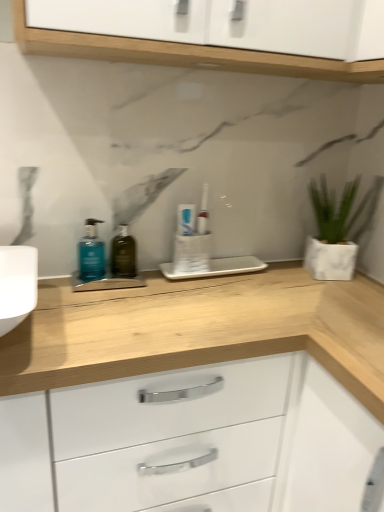
Question: Does green glass bottle at center have a smaller size compared to white glossy toothpaste at center?

Choices:
 (A) no
 (B) yes

Answer: (A)

Question: Is green glass bottle at center thinner than white glossy toothpaste at center?

Choices:
 (A) yes
 (B) no

Answer: (B)

Question: Is green glass bottle at center taller than white glossy toothpaste at center?

Choices:
 (A) yes
 (B) no

Answer: (A)

Question: From the image's perspective, does green glass bottle at center appear lower than white glossy toothpaste at center?

Choices:
 (A) no
 (B) yes

Answer: (B)

Question: Does green glass bottle at center lie in front of white glossy toothpaste at center?

Choices:
 (A) no
 (B) yes

Answer: (B)

Question: Is green glass bottle at center with white glossy toothpaste at center?

Choices:
 (A) no
 (B) yes

Answer: (A)

Question: From the image's perspective, is white glossy toothpaste at center above green glass bottle at center?

Choices:
 (A) no
 (B) yes

Answer: (B)

Question: Can you confirm if white glossy toothpaste at center is shorter than green glass bottle at center?

Choices:
 (A) yes
 (B) no

Answer: (A)

Question: Is white glossy toothpaste at center not close to green glass bottle at center?

Choices:
 (A) no
 (B) yes

Answer: (A)

Question: Considering the relative sizes of white glossy toothpaste at center and green glass bottle at center in the image provided, is white glossy toothpaste at center smaller than green glass bottle at center?

Choices:
 (A) no
 (B) yes

Answer: (B)

Question: From the image's perspective, is white glossy toothpaste at center below green glass bottle at center?

Choices:
 (A) yes
 (B) no

Answer: (B)

Question: Is white glossy toothpaste at center positioned in front of green glass bottle at center?

Choices:
 (A) no
 (B) yes

Answer: (A)

Question: Would you say teal matte pump bottle at left is outside white matte pot at right?

Choices:
 (A) no
 (B) yes

Answer: (B)